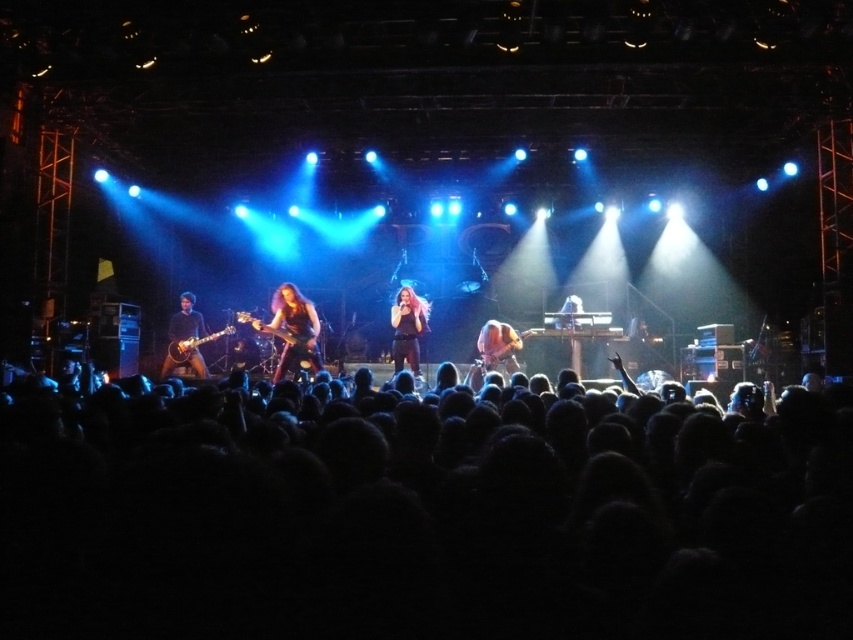
Question: Which object is the closest to the shiny black microphone at center?

Choices:
 (A) shiny brown guitar at center
 (B) black hair at lower center
 (C) glossy black guitar at left

Answer: (A)

Question: Among these objects, which one is nearest to the camera?

Choices:
 (A) glossy black guitar at left
 (B) black hair at lower center
 (C) shiny black guitar at center
 (D) shiny black microphone at center

Answer: (B)

Question: Is matte black guitar at left to the left of shiny black microphone at center from the viewer's perspective?

Choices:
 (A) no
 (B) yes

Answer: (B)

Question: Which object is the closest to the shiny black microphone at center?

Choices:
 (A) shiny brown guitar at center
 (B) shiny black guitar at center

Answer: (A)

Question: Does black hair at lower center appear under shiny black guitar at center?

Choices:
 (A) no
 (B) yes

Answer: (B)

Question: Is shiny black microphone at center to the left of shiny brown guitar at center from the viewer's perspective?

Choices:
 (A) yes
 (B) no

Answer: (A)